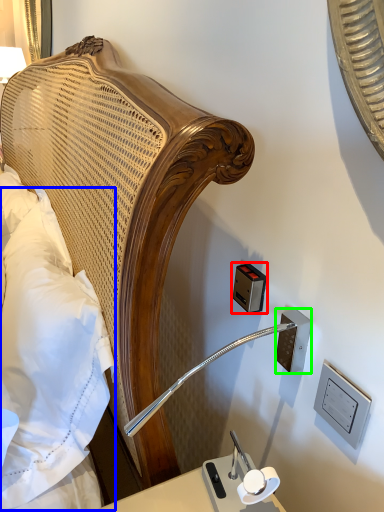
Question: Based on their relative distances, which object is farther from electric outlet (highlighted by a red box)? Choose from pillow (highlighted by a blue box) and electric outlet (highlighted by a green box).

Choices:
 (A) pillow
 (B) electric outlet

Answer: (A)